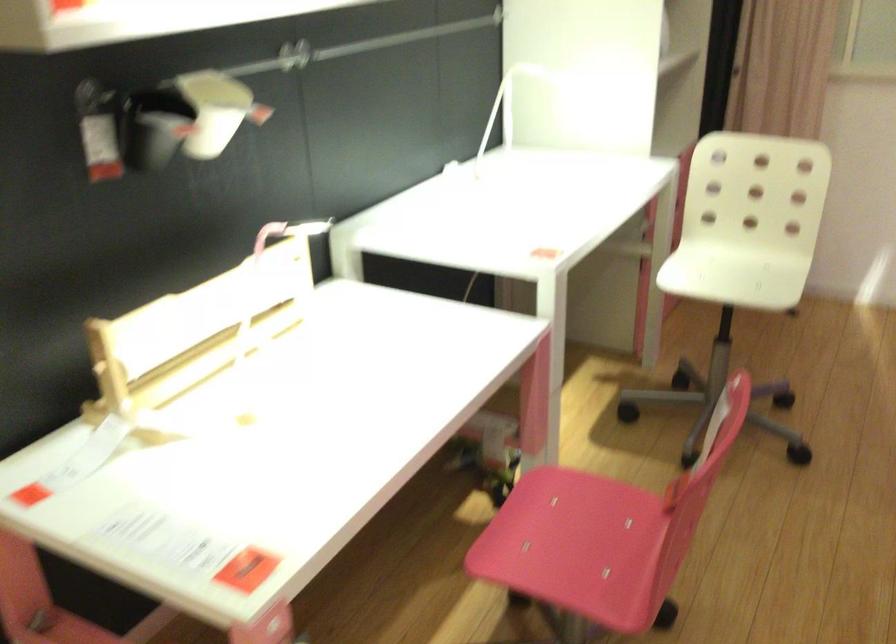
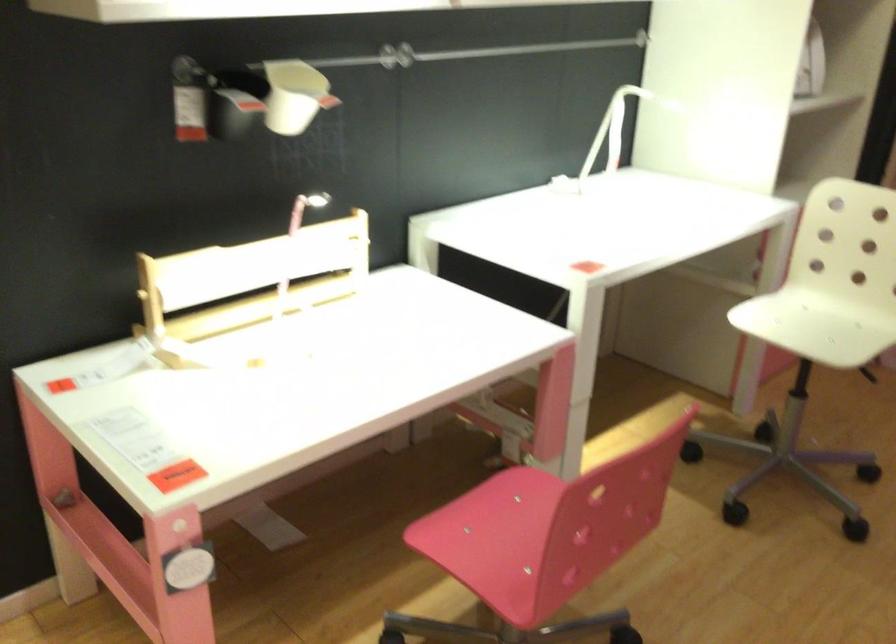
Where in the second image is the point corresponding to (x=227, y=113) from the first image?

(295, 96)